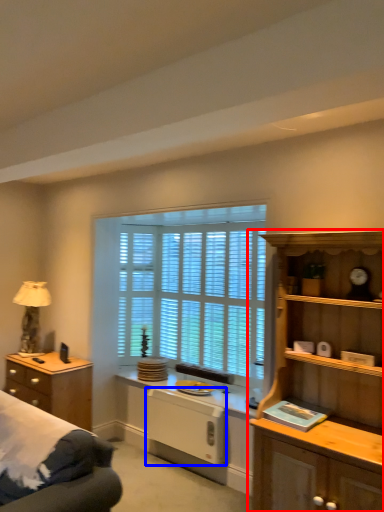
Question: Which object is closer to the camera taking this photo, cabinetry (highlighted by a red box) or appliance (highlighted by a blue box)?

Choices:
 (A) cabinetry
 (B) appliance

Answer: (A)